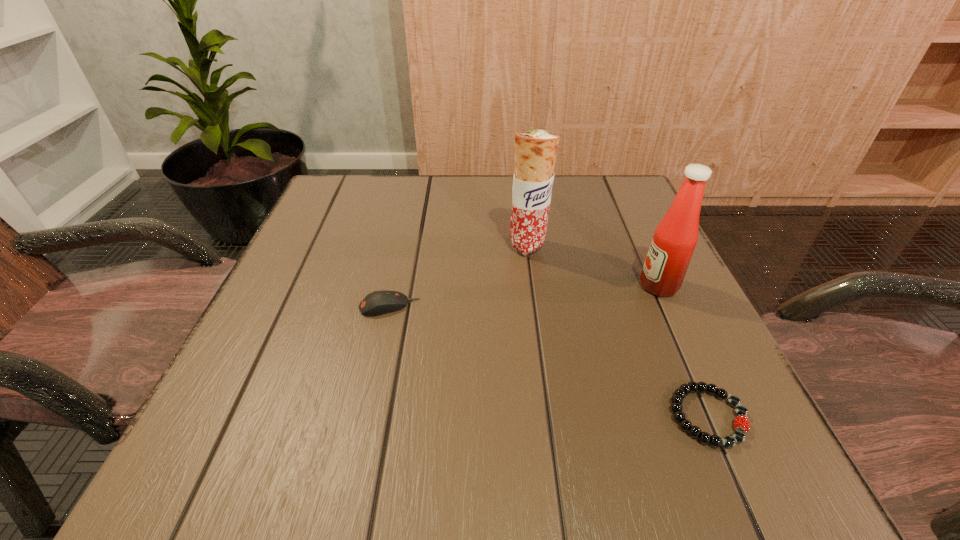
This screenshot has height=540, width=960. Identify the location of vacant position located on the front-facing side of the condiment. tap(564, 286).

Locate an element on the screen. The image size is (960, 540). free space located on the left of the third tallest object is located at coordinates (280, 306).

Where is `vacant space located 0.070m on the left of the bracelet`? This screenshot has width=960, height=540. vacant space located 0.070m on the left of the bracelet is located at coordinates (620, 416).

Image resolution: width=960 pixels, height=540 pixels. I want to click on object present at the near edge, so click(x=741, y=411).

This screenshot has height=540, width=960. Identify the location of condiment positioned at the right edge. (675, 238).

You are a GUI agent. You are given a task and a screenshot of the screen. Output one action in this format:
    pyautogui.click(x=<x>, y=<y>)
    Task: Click on the bracelet present at the right edge
    
    Given the screenshot: What is the action you would take?
    pyautogui.click(x=741, y=411)

Identify the location of object that is at the near right corner. (741, 411).

Locate an element on the screen. The image size is (960, 540). free space at the far edge is located at coordinates (478, 212).

Where is `vacant space at the near edge of the desktop`? vacant space at the near edge of the desktop is located at coordinates (614, 457).

Identify the location of vacant space at the left edge. (310, 268).